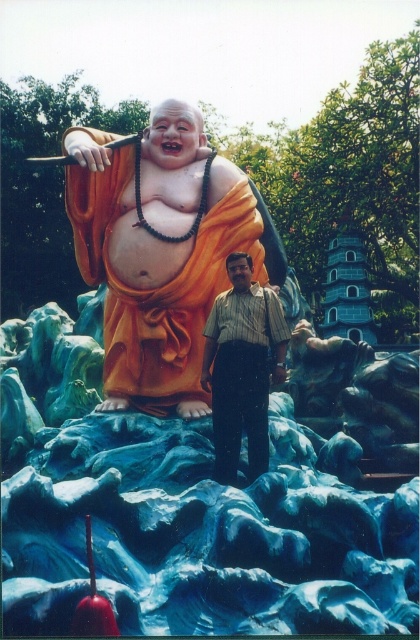
You are a photographer trying to capture a photo of the orange matte statue at center and the striped shirt at center. Based on their positions, which object is closer to the camera?

The orange matte statue at center is positioned over striped shirt at center, which means it is closer to the camera.

You are a photographer trying to capture a group photo of the striped shirt at center and the orange matte statue at center. Given that the statue is wider than the person, how should you position them to ensure both are fully visible in the frame?

Since the orange matte statue at center is wider than the striped shirt at center, position the statue slightly to one side of the frame and center the striped shirt at center in the foreground. This way, the statue occupies more space while still keeping the person visible.

You are a photographer trying to capture a photo of the orange matte statue at center. You want to ensure the striped shirt at center is visible in the background. Can you fit both into your camera frame if your camera has a maximum horizontal field of view of 6 meters?

The orange matte statue at center and striped shirt at center are 5.65 meters apart. Since the distance between them is less than the camera frame of 6 meters, both can be captured in the same frame.